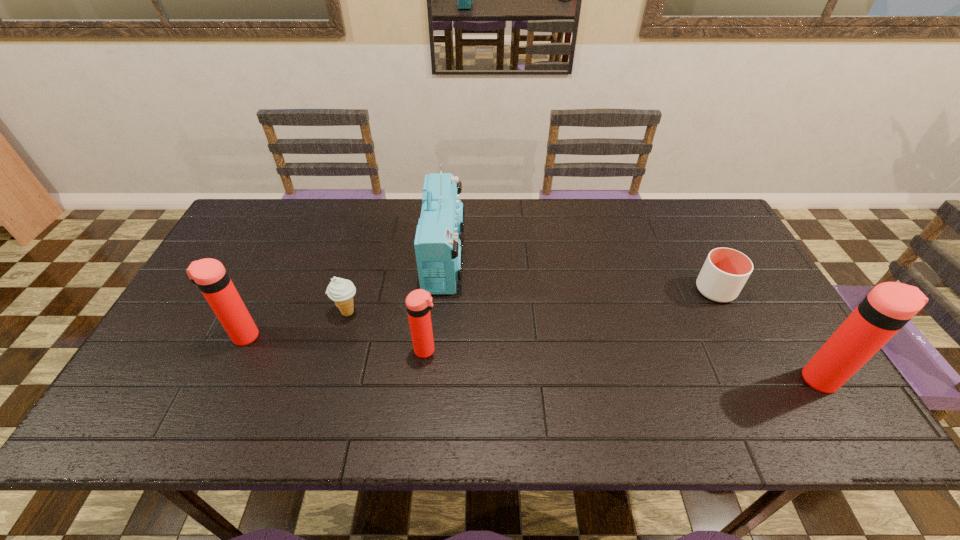
Locate an element on the screen. Image resolution: width=960 pixels, height=540 pixels. unoccupied position between the third shortest object and the radio receiver is located at coordinates (436, 303).

This screenshot has width=960, height=540. I want to click on free space between the second object from right to left and the leftmost object, so click(x=480, y=313).

The image size is (960, 540). Find the location of `free space between the nearest thermos bottle and the cup`. free space between the nearest thermos bottle and the cup is located at coordinates (769, 335).

Where is `free space between the radio receiver and the second thermos bottle from left to right`? free space between the radio receiver and the second thermos bottle from left to right is located at coordinates (436, 303).

The image size is (960, 540). Find the location of `free space between the radio receiver and the icecream`. free space between the radio receiver and the icecream is located at coordinates (396, 285).

Locate an element on the screen. This screenshot has height=540, width=960. vacant area that lies between the tallest thermos bottle and the shortest object is located at coordinates (769, 335).

Identify which object is located as the nearest to the radio receiver. Please provide its 2D coordinates. Your answer should be formatted as a tuple, i.e. [(x, y)], where the tuple contains the x and y coordinates of a point satisfying the conditions above.

[(419, 303)]

Locate which object ranks fourth in proximity to the leftmost thermos bottle. Please provide its 2D coordinates. Your answer should be formatted as a tuple, i.e. [(x, y)], where the tuple contains the x and y coordinates of a point satisfying the conditions above.

[(725, 271)]

Locate which thermos bottle is the second closest to the cup. Please provide its 2D coordinates. Your answer should be formatted as a tuple, i.e. [(x, y)], where the tuple contains the x and y coordinates of a point satisfying the conditions above.

[(419, 303)]

In order to click on thermos bottle that stands as the second closest to the shortest thermos bottle in this screenshot , I will do `click(889, 306)`.